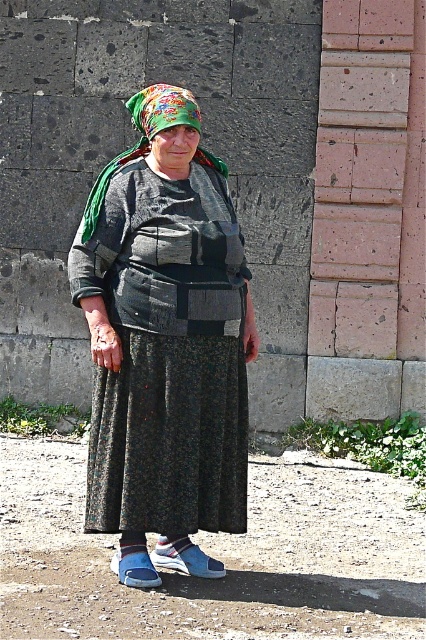
You are standing in front of the elderly woman in the image and want to place a small decoration between the two points, point [158,326] and point [187,109]. Which point should you choose to ensure the decoration is closer to you?

You should choose point [158,326] because it is closer to the viewer than point [187,109].

The elderly woman is wearing a dark gray textured sweater at center and a floral fabric headscarf at center. Which clothing item is wider?

The dark gray textured sweater at center is wider than the floral fabric headscarf at center.